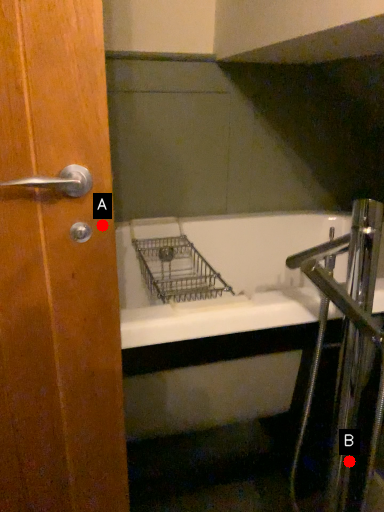
Question: Two points are circled on the image, labeled by A and B beside each circle. Which of the following is the closest to the observer?

Choices:
 (A) A is closer
 (B) B is closer

Answer: (A)